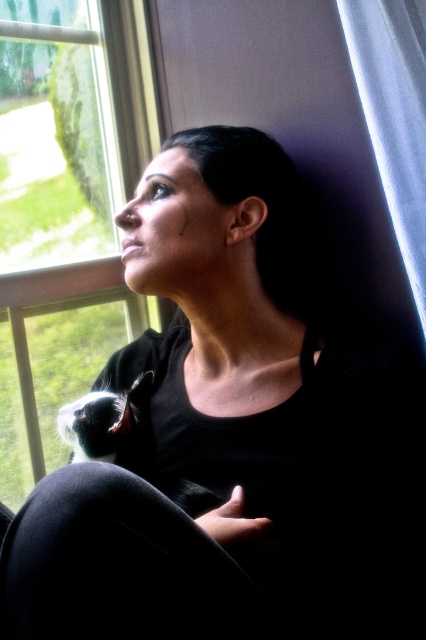
Question: Which point appears farthest from the camera in this image?

Choices:
 (A) (411, 184)
 (B) (40, 38)

Answer: (B)

Question: Does transparent glass window at upper left appear on the left side of white sheer curtain at upper right?

Choices:
 (A) yes
 (B) no

Answer: (A)

Question: Among these points, which one is farthest from the camera?

Choices:
 (A) (120, 64)
 (B) (354, 44)

Answer: (A)

Question: Is transparent glass window at upper left bigger than white sheer curtain at upper right?

Choices:
 (A) no
 (B) yes

Answer: (B)

Question: Can you confirm if transparent glass window at upper left is smaller than white sheer curtain at upper right?

Choices:
 (A) no
 (B) yes

Answer: (A)